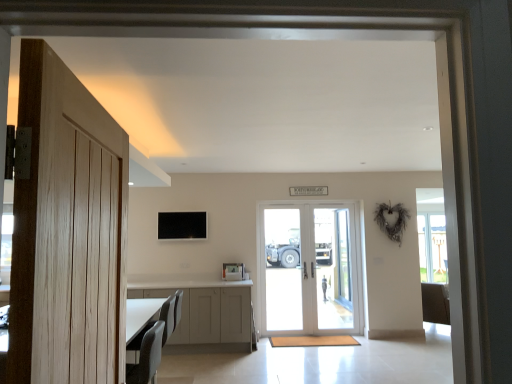
This screenshot has width=512, height=384. Describe the element at coordinates (335, 269) in the screenshot. I see `clear glass door at center, which ranks as the 1th screen door in right-to-left order` at that location.

Consider the image. How much space does clear glass door at center, which ranks as the 1th screen door in right-to-left order, occupy vertically?

clear glass door at center, which ranks as the 1th screen door in right-to-left order, is 6.57 feet in height.

Image resolution: width=512 pixels, height=384 pixels. Describe the element at coordinates (147, 356) in the screenshot. I see `gray fabric armchair at lower left` at that location.

In order to face matte gray chair at lower left, should I rotate leftwards or rightwards?

Rotate your view left by about 13.306°.

What do you see at coordinates (310, 271) in the screenshot? The image size is (512, 384). I see `white glossy door at center, acting as the first door starting from the right` at bounding box center [310, 271].

The width and height of the screenshot is (512, 384). Find the location of `clear glass door at center, which ranks as the 1th screen door in right-to-left order`. clear glass door at center, which ranks as the 1th screen door in right-to-left order is located at coordinates (335, 269).

Does matte gray chair at lower left touch white glossy door at center, which is the 2th door from left to right?

No, matte gray chair at lower left is not beside white glossy door at center, which is the 2th door from left to right.

Looking at this image, is matte gray chair at lower left spatially inside white glossy door at center, which is the 2th door from left to right, or outside of it?

matte gray chair at lower left is located beyond the bounds of white glossy door at center, which is the 2th door from left to right.

Is matte gray chair at lower left wider than white glossy door at center, acting as the first door starting from the right?

Yes.

How distant is matte gray chair at lower left from gray fabric armchair at lower left?

The distance of matte gray chair at lower left from gray fabric armchair at lower left is 3.23 inches.

You are a GUI agent. You are given a task and a screenshot of the screen. Output one action in this format:
    pyautogui.click(x=<x>, y=<y>)
    Task: Click on the furniture on the left side of gray fabric armchair at lower left
    
    Given the screenshot: What is the action you would take?
    pyautogui.click(x=153, y=341)

Is matte gray chair at lower left facing away from gray fabric armchair at lower left?

matte gray chair at lower left does not have its back to gray fabric armchair at lower left.

How many degrees apart are the facing directions of matte gray chair at lower left and gray fabric armchair at lower left?

matte gray chair at lower left and gray fabric armchair at lower left are facing 4.52 degrees away from each other.

Is white glass screen door at center, the 1th screen door viewed from the left, located outside white glossy door at center, acting as the first door starting from the right?

That's incorrect, white glass screen door at center, the 1th screen door viewed from the left, is not completely outside white glossy door at center, acting as the first door starting from the right.

Based on the photo, from the image's perspective, does white glass screen door at center, the 1th screen door viewed from the left, appear lower than white glossy door at center, the first door from the back?

Yes, from the image's perspective, white glass screen door at center, the 1th screen door viewed from the left, is below white glossy door at center, the first door from the back.

Is white glass screen door at center, which ranks as the 2th screen door in right-to-left order, to the left or to the right of white glossy door at center, which is the 2th door from left to right, in the image?

white glass screen door at center, which ranks as the 2th screen door in right-to-left order, is positioned on white glossy door at center, which is the 2th door from left to right,'s left side.

From the picture: Is white glass screen door at center, which ranks as the 2th screen door in right-to-left order, wider than white glossy door at center, acting as the first door starting from the right?

No, white glass screen door at center, which ranks as the 2th screen door in right-to-left order, is not wider than white glossy door at center, acting as the first door starting from the right.

Can clear glass door at center, the 2th screen door viewed from the left, be found inside white glossy door at center, positioned as the 2th door in front-to-back order?

Yes, clear glass door at center, the 2th screen door viewed from the left, is surrounded by white glossy door at center, positioned as the 2th door in front-to-back order.

Is white glossy door at center, the first door from the back, smaller than clear glass door at center, the 2th screen door viewed from the left?

Incorrect, white glossy door at center, the first door from the back, is not smaller in size than clear glass door at center, the 2th screen door viewed from the left.

Is white glossy door at center, which is the 2th door from left to right, oriented away from clear glass door at center, the 2th screen door viewed from the left?

That's right, white glossy door at center, which is the 2th door from left to right, is facing away from clear glass door at center, the 2th screen door viewed from the left.

Which object is positioned more to the right, white glass screen door at center, the 1th screen door viewed from the left, or matte gray chair at lower left?

white glass screen door at center, the 1th screen door viewed from the left, is more to the right.

Does white glass screen door at center, the 1th screen door viewed from the left, have a larger size compared to matte gray chair at lower left?

Actually, white glass screen door at center, the 1th screen door viewed from the left, might be smaller than matte gray chair at lower left.

Between white glass screen door at center, the 1th screen door viewed from the left, and matte gray chair at lower left, which one has more height?

With more height is white glass screen door at center, the 1th screen door viewed from the left.

Consider the image. Is white glass screen door at center, which ranks as the 2th screen door in right-to-left order, facing away from matte gray chair at lower left?

No, white glass screen door at center, which ranks as the 2th screen door in right-to-left order,'s orientation is not away from matte gray chair at lower left.

Which object is more forward, light wood door at left, which is the 1th door in front-to-back order, or gray fabric armchair at lower left?

light wood door at left, which is the 1th door in front-to-back order.

Which of these two, light wood door at left, which is the first door from left to right, or gray fabric armchair at lower left, is bigger?

With larger size is light wood door at left, which is the first door from left to right.

In the image, is light wood door at left, the 2th door viewed from the right, on the left side or the right side of gray fabric armchair at lower left?

Based on their positions, light wood door at left, the 2th door viewed from the right, is located to the right of gray fabric armchair at lower left.

Considering the relative sizes of white glass screen door at center, the 1th screen door viewed from the left, and gray fabric armchair at lower left in the image provided, is white glass screen door at center, the 1th screen door viewed from the left, shorter than gray fabric armchair at lower left?

In fact, white glass screen door at center, the 1th screen door viewed from the left, may be taller than gray fabric armchair at lower left.

Considering the relative positions of white glass screen door at center, the 1th screen door viewed from the left, and gray fabric armchair at lower left in the image provided, is white glass screen door at center, the 1th screen door viewed from the left, behind gray fabric armchair at lower left?

That is True.

Does point (276, 277) come in front of point (161, 322)?

No, (276, 277) is further to viewer.

Could you tell me if white glass screen door at center, which ranks as the 2th screen door in right-to-left order, is turned towards gray fabric armchair at lower left?

No, white glass screen door at center, which ranks as the 2th screen door in right-to-left order, is not oriented towards gray fabric armchair at lower left.

I want to click on the 1st door above the matte gray chair at lower left (from the image's perspective), so click(310, 271).

You are a GUI agent. You are given a task and a screenshot of the screen. Output one action in this format:
    pyautogui.click(x=<x>, y=<y>)
    Task: Click on the furniture located below the gray fabric armchair at lower left (from the image's perspective)
    
    Given the screenshot: What is the action you would take?
    pyautogui.click(x=153, y=341)

When comparing their distances from light wood door at left, which is the first door from left to right, does white glass screen door at center, which ranks as the 2th screen door in right-to-left order, or gray fabric armchair at lower left seem closer?

gray fabric armchair at lower left is positioned closer to the anchor light wood door at left, which is the first door from left to right.

Which object lies further to the anchor point white glossy door at center, positioned as the 2th door in front-to-back order, white glass screen door at center, the 1th screen door viewed from the left, or light wood door at left, which is counted as the 2th door, starting from the back?

light wood door at left, which is counted as the 2th door, starting from the back.

Based on their spatial positions, is white glass screen door at center, which ranks as the 2th screen door in right-to-left order, or clear glass door at center, the 2th screen door viewed from the left, further from white glossy door at center, which is the 2th door from left to right?

white glass screen door at center, which ranks as the 2th screen door in right-to-left order, lies further to white glossy door at center, which is the 2th door from left to right, than the other object.

Estimate the real-world distances between objects in this image. Which object is closer to white glossy door at center, positioned as the 2th door in front-to-back order, matte gray chair at lower left or white glass screen door at center, which ranks as the 2th screen door in right-to-left order?

Based on the image, white glass screen door at center, which ranks as the 2th screen door in right-to-left order, appears to be nearer to white glossy door at center, positioned as the 2th door in front-to-back order.

Based on their spatial positions, is light wood door at left, which is the 1th door in front-to-back order, or gray fabric armchair at lower left closer to clear glass door at center, the 2th screen door viewed from the left?

The object closer to clear glass door at center, the 2th screen door viewed from the left, is gray fabric armchair at lower left.

Based on their spatial positions, is white glass screen door at center, the 1th screen door viewed from the left, or gray fabric armchair at lower left further from matte gray chair at lower left?

white glass screen door at center, the 1th screen door viewed from the left, lies further to matte gray chair at lower left than the other object.

From the image, which object appears to be nearer to matte gray chair at lower left, white glass screen door at center, which ranks as the 2th screen door in right-to-left order, or clear glass door at center, the 2th screen door viewed from the left?

The object closer to matte gray chair at lower left is white glass screen door at center, which ranks as the 2th screen door in right-to-left order.

Estimate the real-world distances between objects in this image. Which object is closer to white glass screen door at center, which ranks as the 2th screen door in right-to-left order, matte gray chair at lower left or clear glass door at center, the 2th screen door viewed from the left?

clear glass door at center, the 2th screen door viewed from the left.

This screenshot has height=384, width=512. What are the coordinates of `armchair between light wood door at left, which is the first door from left to right, and matte gray chair at lower left, along the z-axis` in the screenshot? It's located at (147, 356).

Locate an element on the screen. This screenshot has height=384, width=512. door between matte gray chair at lower left and clear glass door at center, the 2th screen door viewed from the left, in the front-back direction is located at coordinates coord(310,271).

Locate an element on the screen. The height and width of the screenshot is (384, 512). armchair between light wood door at left, which is the first door from left to right, and white glossy door at center, which is the 2th door from left to right, from front to back is located at coordinates (147, 356).

Find the location of `furniture located between gray fabric armchair at lower left and clear glass door at center, which ranks as the 1th screen door in right-to-left order, in the depth direction`. furniture located between gray fabric armchair at lower left and clear glass door at center, which ranks as the 1th screen door in right-to-left order, in the depth direction is located at coordinates (153, 341).